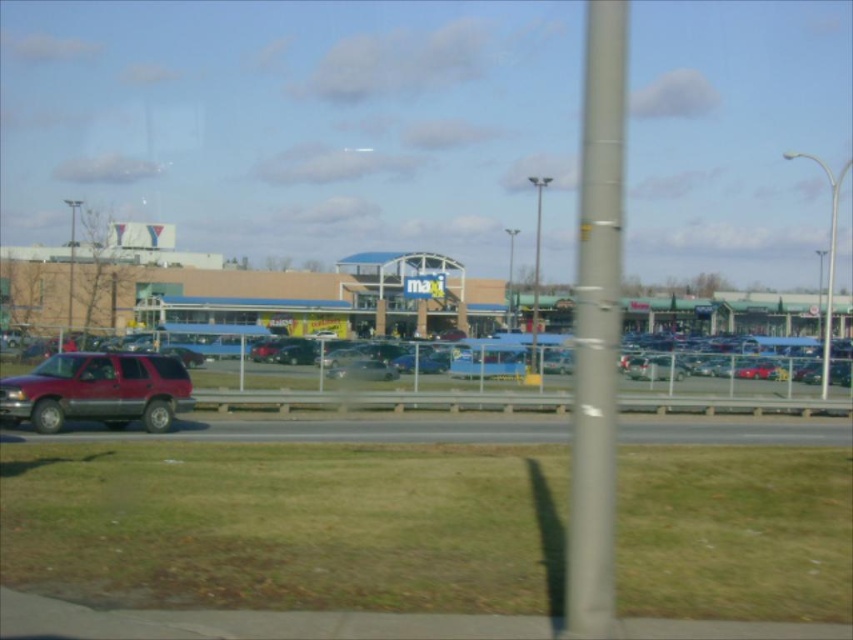
Does beige brick mall at center have a greater width compared to metallic pole at center?

Indeed, beige brick mall at center has a greater width compared to metallic pole at center.

Does beige brick mall at center have a smaller size compared to metallic pole at center?

No, beige brick mall at center is not smaller than metallic pole at center.

This screenshot has height=640, width=853. Identify the location of beige brick mall at center. (231, 289).

This screenshot has height=640, width=853. Find the location of `beige brick mall at center`. beige brick mall at center is located at coordinates (231, 289).

Which is in front, point (32, 259) or point (440, 419)?

Positioned in front is point (440, 419).

Does beige brick mall at center have a lesser width compared to gray asphalt highway at lower center?

In fact, beige brick mall at center might be wider than gray asphalt highway at lower center.

Who is more distant from viewer, (177,321) or (474,433)?

The point (177,321) is more distant.

At what (x,y) coordinates should I click in order to perform the action: click on beige brick mall at center. Please return your answer as a coordinate pair (x, y). The width and height of the screenshot is (853, 640). Looking at the image, I should click on (231, 289).

Identify the location of beige brick mall at center. This screenshot has width=853, height=640. (231, 289).

Which is above, beige brick mall at center or shiny maroon suv at left?

beige brick mall at center is above.

Is point (316, 294) closer to camera compared to point (53, 406)?

No, (316, 294) is behind (53, 406).

Find the location of a particular element. beige brick mall at center is located at coordinates (231, 289).